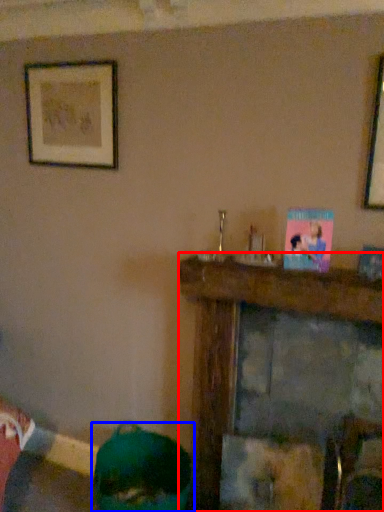
Question: Which object is closer to the camera taking this photo, furniture (highlighted by a red box) or person (highlighted by a blue box)?

Choices:
 (A) furniture
 (B) person

Answer: (A)